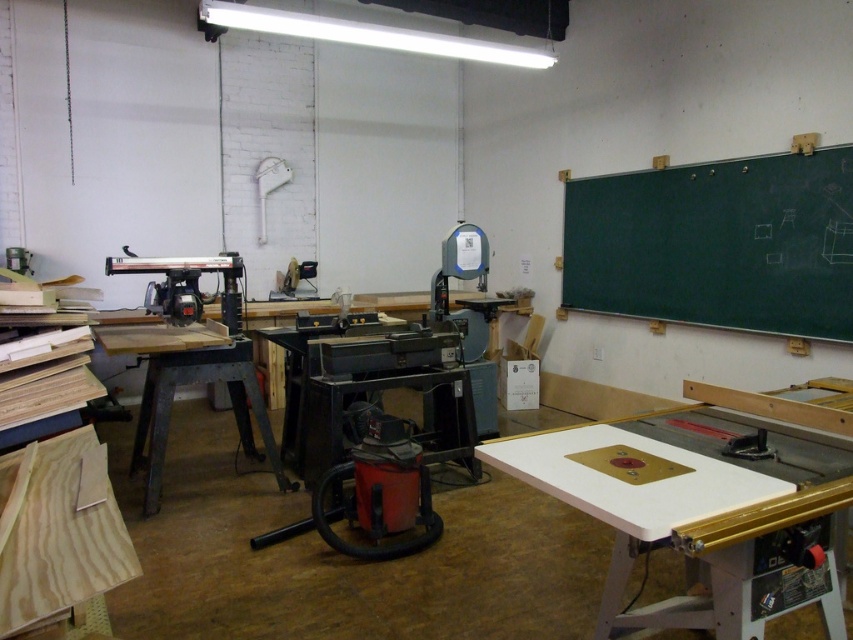
Question: Estimate the real-world distances between objects in this image. Which object is closer to the metallic gray workbench at center?

Choices:
 (A) green chalkboard at upper right
 (B) white glossy table at center

Answer: (B)

Question: Does green chalkboard at upper right come behind metallic gray workbench at center?

Choices:
 (A) no
 (B) yes

Answer: (B)

Question: Which point appears farthest from the camera in this image?

Choices:
 (A) (550, 470)
 (B) (833, 161)
 (C) (107, 353)

Answer: (B)

Question: Is white glossy table at center to the left of metallic gray workbench at center from the viewer's perspective?

Choices:
 (A) yes
 (B) no

Answer: (B)

Question: Can you confirm if white glossy table at center is positioned to the right of metallic gray workbench at center?

Choices:
 (A) no
 (B) yes

Answer: (B)

Question: Which of the following is the farthest from the observer?

Choices:
 (A) 824,280
 (B) 640,500
 (C) 187,372

Answer: (A)